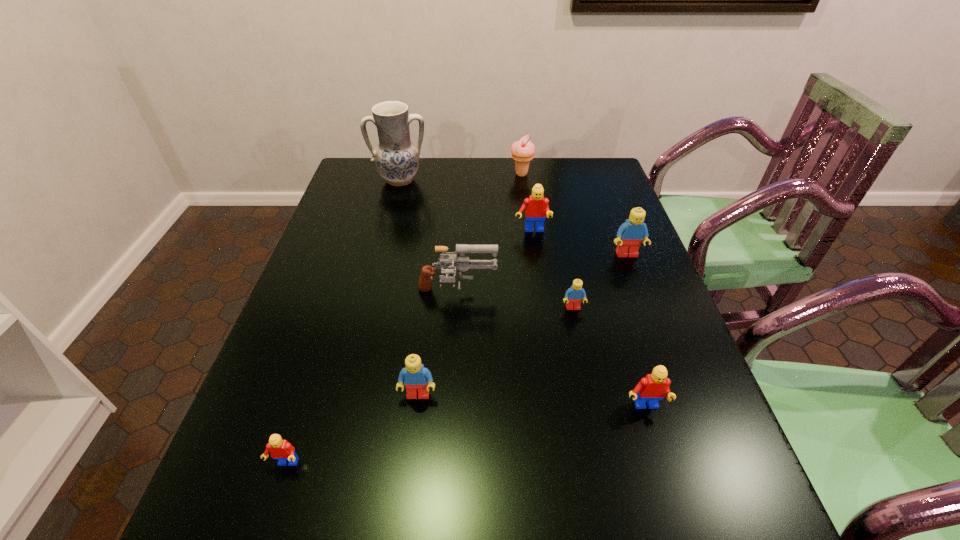
Find the location of a particular element. Image resolution: width=960 pixels, height=540 pixels. the rightmost red Lego is located at coordinates (654, 387).

The width and height of the screenshot is (960, 540). Identify the location of the second farthest red Lego. (654, 387).

I want to click on the fourth nearest Lego, so click(x=575, y=294).

I want to click on the second nearest blue Lego, so click(x=575, y=294).

In order to click on the leftmost red Lego in this screenshot , I will do `click(280, 449)`.

At what (x,y) coordinates should I click in order to perform the action: click on the smallest red Lego. Please return your answer as a coordinate pair (x, y). Looking at the image, I should click on (280, 449).

The height and width of the screenshot is (540, 960). I want to click on free space located 0.070m on the front of the pottery, so click(x=395, y=202).

Where is `free space located 0.070m on the front of the icecream`? free space located 0.070m on the front of the icecream is located at coordinates (523, 191).

Where is `blank space located on the face of the biggest blue Lego`? blank space located on the face of the biggest blue Lego is located at coordinates (650, 316).

Find the location of a particular element. Image resolution: width=960 pixels, height=540 pixels. free space located 0.070m on the front-facing side of the second red Lego from right to left is located at coordinates (535, 251).